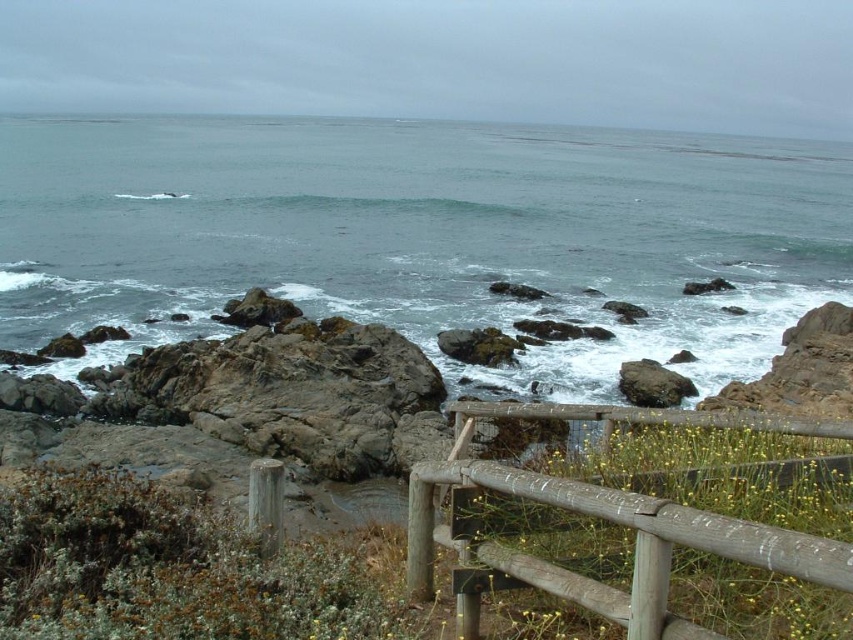
You are a hiker who wants to cross the rugged shoreline. You see a gray rock at center and a brown wooden fence at center. Which one is taller and would block your view more?

The gray rock at center is much taller than the brown wooden fence at center, so it would block your view more.

You are standing at the wooden railing in the coastal scene. You want to place a small potted plant exactly at the gray rock at center. According to the coordinates provided, where should you place the plant relative to the railing?

The gray rock at center is located at coordinates point (422, 234). Since the railing is in the foreground and runs horizontally across the frame, you should place the plant slightly to the left and above the center of the railing to match the rock at center.